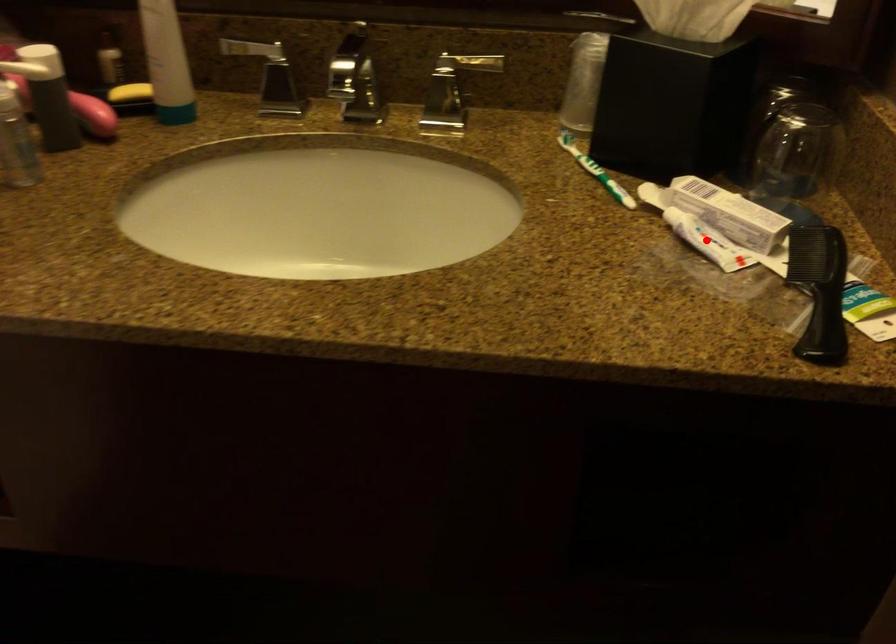
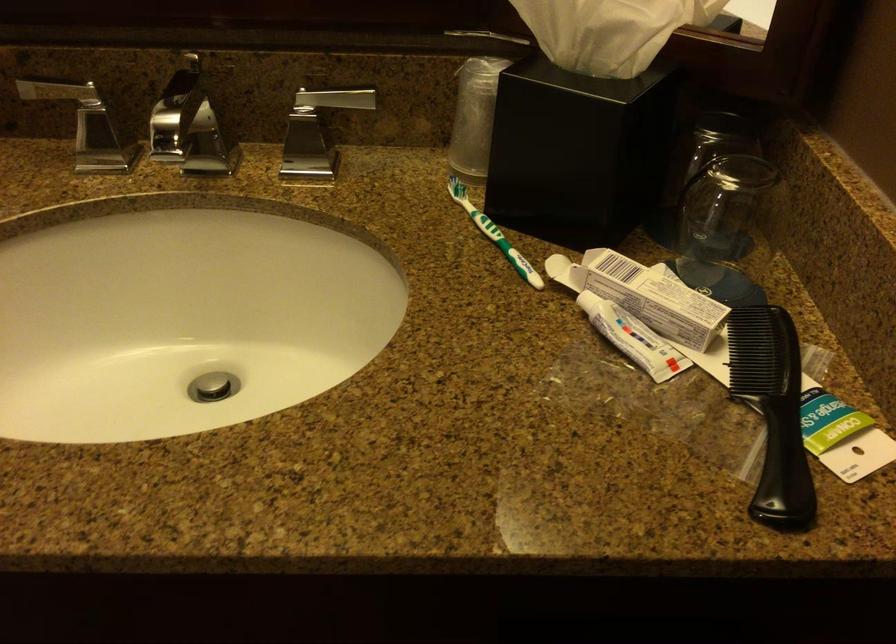
Question: I am providing you with two images of the same scene from different viewpoints. A red point is shown in image1. For the corresponding object point in image2, is it positioned nearer or farther from the camera?

Choices:
 (A) Nearer
 (B) Farther

Answer: (A)